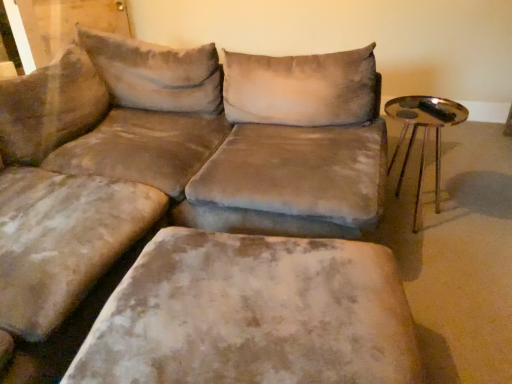
Question: From the image's perspective, is velvet beige ottoman at lower center positioned above or below shiny metallic tray at right?

Choices:
 (A) above
 (B) below

Answer: (B)

Question: Considering the positions of velvet beige ottoman at lower center and shiny metallic tray at right in the image, is velvet beige ottoman at lower center taller or shorter than shiny metallic tray at right?

Choices:
 (A) tall
 (B) short

Answer: (B)

Question: Considering the positions of velvet beige ottoman at lower center and shiny metallic tray at right in the image, is velvet beige ottoman at lower center bigger or smaller than shiny metallic tray at right?

Choices:
 (A) big
 (B) small

Answer: (A)

Question: From a real-world perspective, is shiny metallic tray at right positioned above or below velvet beige ottoman at lower center?

Choices:
 (A) above
 (B) below

Answer: (A)

Question: Is shiny metallic tray at right inside or outside of velvet beige ottoman at lower center?

Choices:
 (A) inside
 (B) outside

Answer: (B)

Question: Is shiny metallic tray at right bigger or smaller than velvet beige ottoman at lower center?

Choices:
 (A) big
 (B) small

Answer: (B)

Question: In terms of height, does shiny metallic tray at right look taller or shorter compared to velvet beige ottoman at lower center?

Choices:
 (A) tall
 (B) short

Answer: (A)